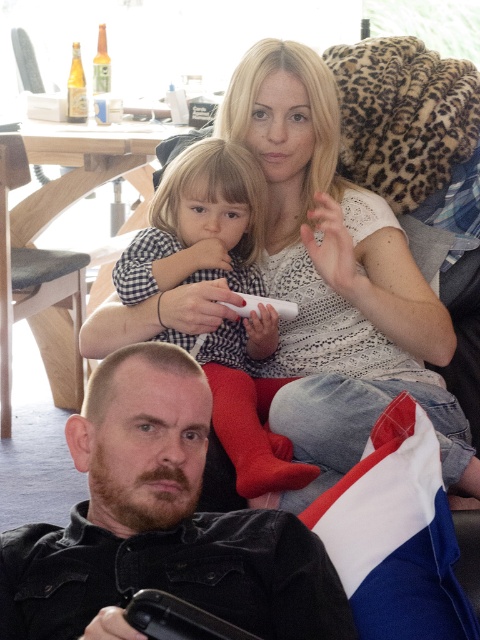
You are standing in the living room and want to place a small plant between the two points, point (x=253, y=524) and point (x=172, y=236). Which point should the plant be closer to in order to be placed at the midpoint between them?

The plant should be placed closer to point (x=172, y=236) because point (x=253, y=524) is closer to the camera than point (x=172, y=236), so the midpoint would be closer to the farther point.

You are a photographer trying to capture a clear shot of both the checkered fabric shirt at upper center and the white plastic remote at center. Which object should you focus on first to ensure both are in focus?

The checkered fabric shirt at upper center is positioned under the white plastic remote at center. To ensure both are in focus, you should focus on the white plastic remote at center first since it is closer to the camera, allowing the shirt to be within the depth of field.

You are standing in the living room and want to place a small potted plant on the couch near the dark brown leather jacket at lower left. Based on its 2D coordinates, where should you place the plant?

The dark brown leather jacket at lower left is located at coordinates point (159, 524). To place the plant near it, position the plant close to these coordinates on the couch.